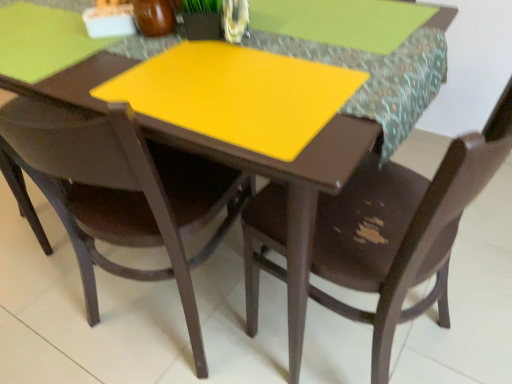
Question: Which direction should I rotate to look at brown matte chair at center, which is counted as the first chair, starting from the right, — up or down?

Choices:
 (A) up
 (B) down

Answer: (B)

Question: From the image's perspective, is brown matte chair at center, acting as the 2th chair starting from the left, below yellow matte placemat at center?

Choices:
 (A) no
 (B) yes

Answer: (B)

Question: Is brown matte chair at center, acting as the 2th chair starting from the left, closer to camera compared to yellow matte placemat at center?

Choices:
 (A) no
 (B) yes

Answer: (B)

Question: Considering the relative sizes of brown matte chair at center, acting as the 2th chair starting from the left, and yellow matte placemat at center in the image provided, is brown matte chair at center, acting as the 2th chair starting from the left, bigger than yellow matte placemat at center?

Choices:
 (A) yes
 (B) no

Answer: (A)

Question: From a real-world perspective, is brown matte chair at center, acting as the 2th chair starting from the left, physically below yellow matte placemat at center?

Choices:
 (A) yes
 (B) no

Answer: (A)

Question: From a real-world perspective, is brown matte chair at center, which is counted as the first chair, starting from the right, positioned over yellow matte placemat at center based on gravity?

Choices:
 (A) no
 (B) yes

Answer: (A)

Question: Considering the relative sizes of brown matte chair at center, acting as the 2th chair starting from the left, and yellow matte placemat at center in the image provided, is brown matte chair at center, acting as the 2th chair starting from the left, thinner than yellow matte placemat at center?

Choices:
 (A) yes
 (B) no

Answer: (B)

Question: Is yellow matte placemat at center to the left of brown matte chair at center, which is counted as the first chair, starting from the right, from the viewer's perspective?

Choices:
 (A) no
 (B) yes

Answer: (B)

Question: Does yellow matte placemat at center have a lesser height compared to brown matte chair at center, which is counted as the first chair, starting from the right?

Choices:
 (A) no
 (B) yes

Answer: (B)

Question: Is yellow matte placemat at center smaller than brown matte chair at center, which is counted as the first chair, starting from the right?

Choices:
 (A) no
 (B) yes

Answer: (B)

Question: Does yellow matte placemat at center have a greater width compared to brown matte chair at center, which is counted as the first chair, starting from the right?

Choices:
 (A) no
 (B) yes

Answer: (A)

Question: Is yellow matte placemat at center positioned far away from brown matte chair at center, which is counted as the first chair, starting from the right?

Choices:
 (A) yes
 (B) no

Answer: (B)

Question: Considering the relative positions of yellow matte placemat at center and brown matte chair at center, acting as the 2th chair starting from the left, in the image provided, is yellow matte placemat at center to the right of brown matte chair at center, acting as the 2th chair starting from the left, from the viewer's perspective?

Choices:
 (A) no
 (B) yes

Answer: (A)

Question: From a real-world perspective, is matte brown chair at center, the second chair viewed from the right, physically below yellow matte placemat at center?

Choices:
 (A) no
 (B) yes

Answer: (B)